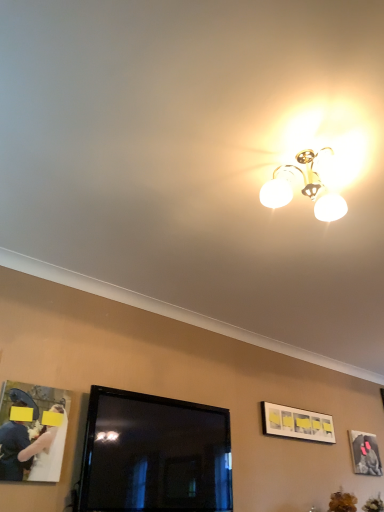
The width and height of the screenshot is (384, 512). What are the coordinates of `matte black picture frame at upper right, which ranks as the 1th picture frame in bottom-to-top order` in the screenshot? It's located at (365, 453).

You are a GUI agent. You are given a task and a screenshot of the screen. Output one action in this format:
    pyautogui.click(x=<x>, y=<y>)
    Task: Click on the black glossy tv at center
    The height and width of the screenshot is (512, 384).
    Given the screenshot: What is the action you would take?
    pyautogui.click(x=154, y=455)

The height and width of the screenshot is (512, 384). I want to click on white matte picture frame at upper right, placed as the first picture frame when sorted from front to back, so pyautogui.click(x=297, y=423).

Identify the location of matte black picture frame at upper right, which ranks as the 1th picture frame in bottom-to-top order. click(365, 453).

From their relative heights in the image, would you say white satin dress at lower left is taller or shorter than black glossy tv at center?

white satin dress at lower left is shorter than black glossy tv at center.

Looking at this image, considering the positions of objects white satin dress at lower left and black glossy tv at center in the image provided, who is behind, white satin dress at lower left or black glossy tv at center?

black glossy tv at center is behind.

Would you say white satin dress at lower left is inside or outside black glossy tv at center?

Result: white satin dress at lower left is located beyond the bounds of black glossy tv at center.

Are white satin dress at lower left and black glossy tv at center located far from each other?

That's not correct — white satin dress at lower left is a little close to black glossy tv at center.

Between matte black picture frame at upper right, which appears as the second picture frame when viewed from the left, and black glossy tv at center, which one has smaller size?

Smaller between the two is matte black picture frame at upper right, which appears as the second picture frame when viewed from the left.

Which is more to the right, matte black picture frame at upper right, which ranks as the 1th picture frame in bottom-to-top order, or black glossy tv at center?

From the viewer's perspective, matte black picture frame at upper right, which ranks as the 1th picture frame in bottom-to-top order, appears more on the right side.

Which point is more forward, (363, 436) or (116, 482)?

The point (116, 482) is closer to the camera.

From the image's perspective, is matte black picture frame at upper right, the 1th picture frame viewed from the back, located above black glossy tv at center?

No, from the image's perspective, matte black picture frame at upper right, the 1th picture frame viewed from the back, is not on top of black glossy tv at center.

Based on the photo, could you tell me if black glossy tv at center is facing matte black picture frame at upper right, arranged as the 2th picture frame when viewed from the top?

No, black glossy tv at center is not turned towards matte black picture frame at upper right, arranged as the 2th picture frame when viewed from the top.

Is black glossy tv at center not near matte black picture frame at upper right, the 1th picture frame viewed from the back?

Yes, black glossy tv at center and matte black picture frame at upper right, the 1th picture frame viewed from the back, are quite far apart.

Is matte black picture frame at upper right, the first picture frame in the right-to-left sequence, completely or partially inside black glossy tv at center?

Definitely not — matte black picture frame at upper right, the first picture frame in the right-to-left sequence, is not inside black glossy tv at center.

Between black glossy tv at center and matte black picture frame at upper right, the first picture frame in the right-to-left sequence, which one has larger width?

black glossy tv at center is wider.

Is white matte picture frame at upper right, positioned as the second picture frame in bottom-to-top order, closer to the viewer compared to matte black picture frame at upper right, marked as the second picture frame in a front-to-back arrangement?

Yes, white matte picture frame at upper right, positioned as the second picture frame in bottom-to-top order, is closer to the viewer.

Locate an element on the screen. Image resolution: width=384 pixels, height=512 pixels. picture frame behind the white matte picture frame at upper right, the 1th picture frame viewed from the left is located at coordinates (365, 453).

Would you say white matte picture frame at upper right, the 2th picture frame from the back, is outside matte black picture frame at upper right, the 1th picture frame viewed from the back?

Indeed, white matte picture frame at upper right, the 2th picture frame from the back, is completely outside matte black picture frame at upper right, the 1th picture frame viewed from the back.

Is white matte picture frame at upper right, the 2th picture frame from the back, oriented towards matte black picture frame at upper right, the first picture frame in the right-to-left sequence?

No, white matte picture frame at upper right, the 2th picture frame from the back, does not turn towards matte black picture frame at upper right, the first picture frame in the right-to-left sequence.

Does black glossy tv at center have a greater width compared to white matte picture frame at upper right, the second picture frame viewed from the right?

Indeed, black glossy tv at center has a greater width compared to white matte picture frame at upper right, the second picture frame viewed from the right.

From the image's perspective, between black glossy tv at center and white matte picture frame at upper right, the 2th picture frame from the back, which one is located above?

black glossy tv at center.

Based on the photo, choose the correct answer: Is black glossy tv at center inside white matte picture frame at upper right, marked as the first picture frame in a top-to-bottom arrangement, or outside it?

black glossy tv at center is not enclosed by white matte picture frame at upper right, marked as the first picture frame in a top-to-bottom arrangement.

Measure the distance between black glossy tv at center and white matte picture frame at upper right, positioned as the second picture frame in bottom-to-top order.

black glossy tv at center and white matte picture frame at upper right, positioned as the second picture frame in bottom-to-top order, are 1.06 meters apart.

How different are the orientations of matte black picture frame at upper right, marked as the second picture frame in a front-to-back arrangement, and white matte picture frame at upper right, marked as the first picture frame in a top-to-bottom arrangement, in degrees?

0.964 degrees.

How much distance is there between matte black picture frame at upper right, the first picture frame in the right-to-left sequence, and white matte picture frame at upper right, the 2th picture frame from the back?

29.89 inches.

Is matte black picture frame at upper right, which appears as the second picture frame when viewed from the left, situated inside white matte picture frame at upper right, marked as the first picture frame in a top-to-bottom arrangement, or outside?

The correct answer is: outside.

Based on the photo, which of these two, matte black picture frame at upper right, the 1th picture frame viewed from the back, or white matte picture frame at upper right, marked as the first picture frame in a top-to-bottom arrangement, is smaller?

With smaller size is matte black picture frame at upper right, the 1th picture frame viewed from the back.

In terms of size, does matte black picture frame at upper right, the 1th picture frame viewed from the back, appear bigger or smaller than white satin dress at lower left?

Clearly, matte black picture frame at upper right, the 1th picture frame viewed from the back, is larger in size than white satin dress at lower left.

From the image's perspective, is matte black picture frame at upper right, which appears as the second picture frame when viewed from the left, above or below white satin dress at lower left?

Clearly, from the image's perspective, matte black picture frame at upper right, which appears as the second picture frame when viewed from the left, is below white satin dress at lower left.

Are matte black picture frame at upper right, marked as the second picture frame in a front-to-back arrangement, and white satin dress at lower left located far from each other?

Yes.

Is matte black picture frame at upper right, which ranks as the 1th picture frame in bottom-to-top order, positioned beyond the bounds of white satin dress at lower left?

Indeed, matte black picture frame at upper right, which ranks as the 1th picture frame in bottom-to-top order, is completely outside white satin dress at lower left.

Image resolution: width=384 pixels, height=512 pixels. Identify the location of television that appears on the right of white satin dress at lower left. (154, 455).

In order to click on the 1st picture frame above the black glossy tv at center (from a real-world perspective) in this screenshot , I will do `click(365, 453)`.

Estimate the real-world distances between objects in this image. Which object is closer to black glossy tv at center, white matte picture frame at upper right, positioned as the second picture frame in bottom-to-top order, or white satin dress at lower left?

white satin dress at lower left is positioned closer to the anchor black glossy tv at center.

Estimate the real-world distances between objects in this image. Which object is further from white matte picture frame at upper right, marked as the first picture frame in a top-to-bottom arrangement, white satin dress at lower left or black glossy tv at center?

Based on the image, white satin dress at lower left appears to be further to white matte picture frame at upper right, marked as the first picture frame in a top-to-bottom arrangement.

Estimate the real-world distances between objects in this image. Which object is further from white matte picture frame at upper right, placed as the first picture frame when sorted from front to back, matte black picture frame at upper right, the 1th picture frame viewed from the back, or white satin dress at lower left?

white satin dress at lower left lies further to white matte picture frame at upper right, placed as the first picture frame when sorted from front to back, than the other object.

Based on their spatial positions, is white matte picture frame at upper right, the 1th picture frame viewed from the left, or white satin dress at lower left closer to matte black picture frame at upper right, the first picture frame in the right-to-left sequence?

The object closer to matte black picture frame at upper right, the first picture frame in the right-to-left sequence, is white matte picture frame at upper right, the 1th picture frame viewed from the left.

Which object lies further to the anchor point white matte picture frame at upper right, the second picture frame viewed from the right, white satin dress at lower left or matte black picture frame at upper right, which ranks as the 1th picture frame in bottom-to-top order?

white satin dress at lower left is further to white matte picture frame at upper right, the second picture frame viewed from the right.

Considering their positions, is black glossy tv at center positioned further to white matte picture frame at upper right, the 2th picture frame from the back, than matte black picture frame at upper right, which ranks as the 1th picture frame in bottom-to-top order?

Based on the image, black glossy tv at center appears to be further to white matte picture frame at upper right, the 2th picture frame from the back.

When comparing their distances from matte black picture frame at upper right, which ranks as the 1th picture frame in bottom-to-top order, does white satin dress at lower left or black glossy tv at center seem closer?

black glossy tv at center is closer to matte black picture frame at upper right, which ranks as the 1th picture frame in bottom-to-top order.

Looking at this image, estimate the real-world distances between objects in this image. Which object is closer to white matte picture frame at upper right, placed as the first picture frame when sorted from front to back, black glossy tv at center or white satin dress at lower left?

black glossy tv at center.

This screenshot has width=384, height=512. Find the location of `picture frame between white satin dress at lower left and matte black picture frame at upper right, the 1th picture frame viewed from the back, in the horizontal direction`. picture frame between white satin dress at lower left and matte black picture frame at upper right, the 1th picture frame viewed from the back, in the horizontal direction is located at coordinates (297, 423).

Locate an element on the screen. picture frame between black glossy tv at center and matte black picture frame at upper right, which appears as the second picture frame when viewed from the left, from left to right is located at coordinates (297, 423).

The image size is (384, 512). In order to click on television situated between white satin dress at lower left and white matte picture frame at upper right, the 2th picture frame from the back, from left to right in this screenshot , I will do `click(154, 455)`.

Where is `television located between white satin dress at lower left and matte black picture frame at upper right, which ranks as the 1th picture frame in bottom-to-top order, in the left-right direction`? The width and height of the screenshot is (384, 512). television located between white satin dress at lower left and matte black picture frame at upper right, which ranks as the 1th picture frame in bottom-to-top order, in the left-right direction is located at coordinates (154, 455).